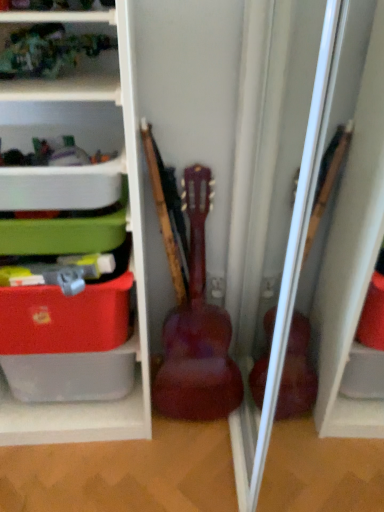
Image resolution: width=384 pixels, height=512 pixels. Find the location of `vacant space situated above matte plastic storage box at left (from a real-world perspective)`. vacant space situated above matte plastic storage box at left (from a real-world perspective) is located at coordinates (62, 270).